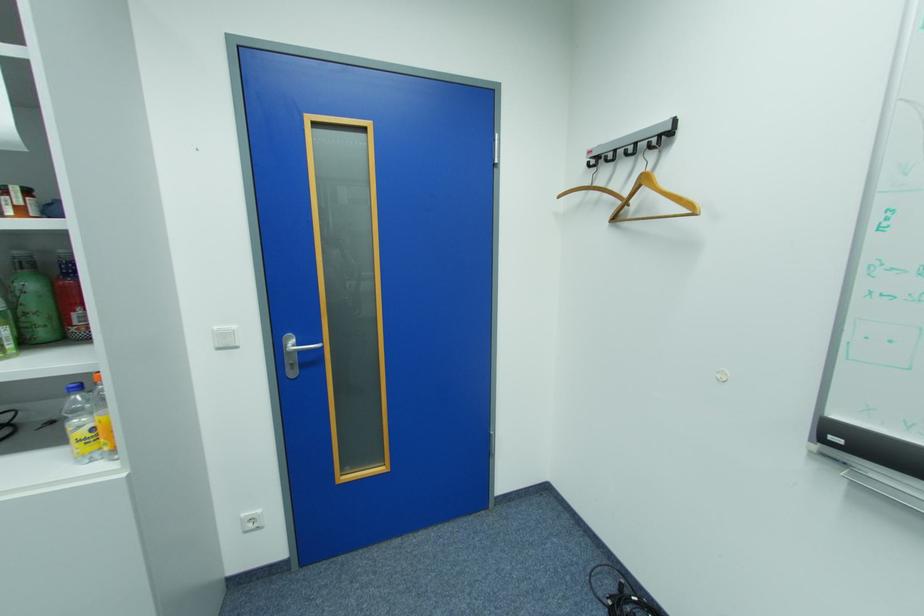
The width and height of the screenshot is (924, 616). Find the location of `whiteboard marker tray`. whiteboard marker tray is located at coordinates [870, 446].